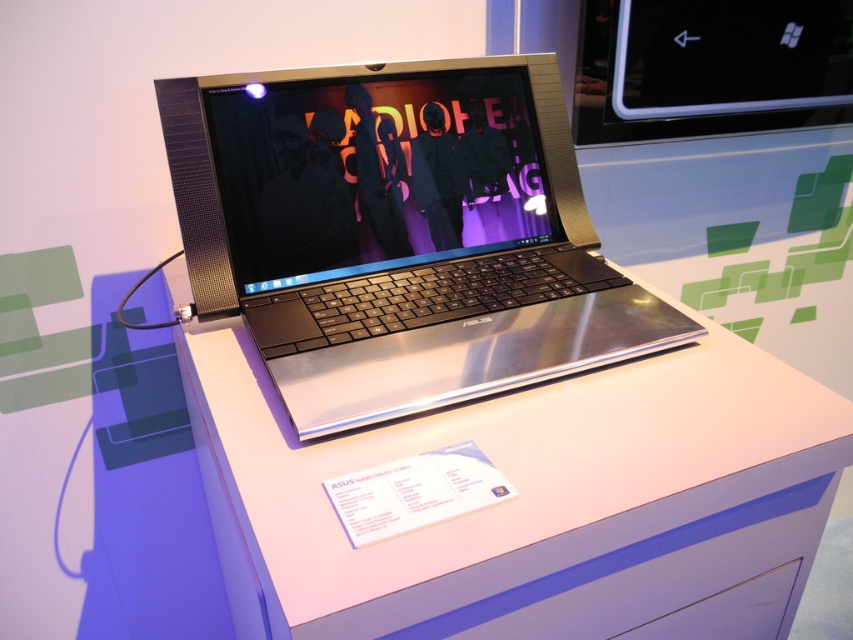
Question: Which object appears farthest from the camera in this image?

Choices:
 (A) silver metallic laptop at center
 (B) silver metallic table at center
 (C) matte purple drawer at lower center

Answer: (A)

Question: Among these objects, which one is nearest to the camera?

Choices:
 (A) silver metallic laptop at center
 (B) silver metallic table at center

Answer: (B)

Question: Which of the following is the farthest from the observer?

Choices:
 (A) silver metallic table at center
 (B) silver metallic laptop at center
 (C) matte purple drawer at lower center

Answer: (B)

Question: Can you confirm if silver metallic table at center is wider than silver metallic laptop at center?

Choices:
 (A) yes
 (B) no

Answer: (A)

Question: Can you confirm if silver metallic laptop at center is positioned to the right of matte purple drawer at lower center?

Choices:
 (A) yes
 (B) no

Answer: (B)

Question: Does silver metallic table at center have a lesser width compared to matte purple drawer at lower center?

Choices:
 (A) no
 (B) yes

Answer: (A)